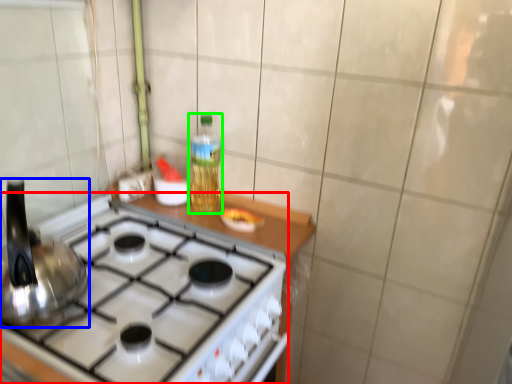
Question: Estimate the real-world distances between objects in this image. Which object is closer to gas stove (highlighted by a red box), kitchen appliance (highlighted by a blue box) or bottle (highlighted by a green box)?

Choices:
 (A) kitchen appliance
 (B) bottle

Answer: (A)